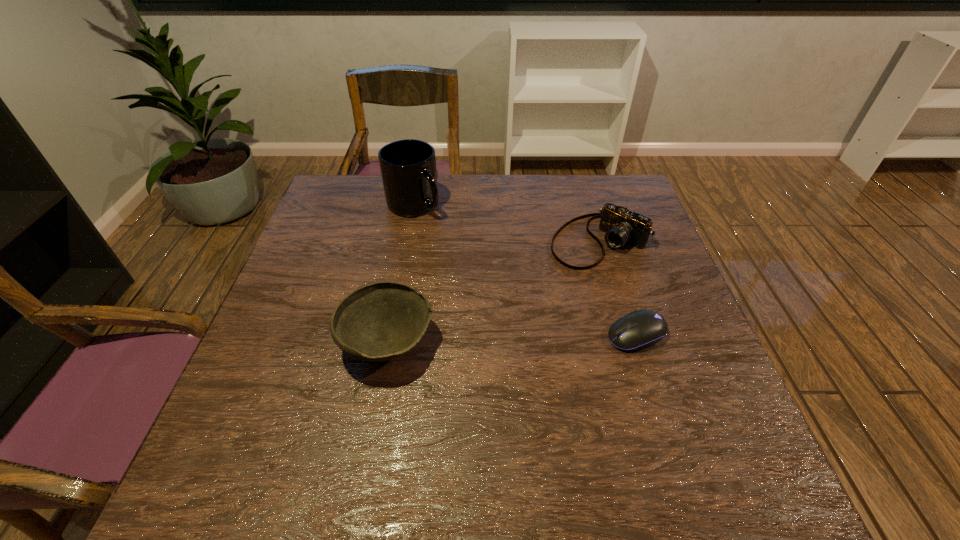
The width and height of the screenshot is (960, 540). What are the coordinates of `vacant space located on the front-facing side of the third tallest object` in the screenshot? It's located at (510, 312).

The height and width of the screenshot is (540, 960). I want to click on free space located on the front-facing side of the third tallest object, so (x=529, y=296).

The height and width of the screenshot is (540, 960). Find the location of `mug that is at the far edge`. mug that is at the far edge is located at coordinates (408, 167).

Identify the location of camera at the far edge. (621, 226).

This screenshot has height=540, width=960. What are the coordinates of `computer mouse that is at the right edge` in the screenshot? It's located at (640, 329).

The height and width of the screenshot is (540, 960). What are the coordinates of `camera at the right edge` in the screenshot? It's located at (621, 226).

The width and height of the screenshot is (960, 540). Identify the location of object present at the far right corner. (621, 226).

Identify the location of vacant point at the far edge. (472, 183).

In the image, there is a desktop. Where is `vacant region at the left edge`? vacant region at the left edge is located at coordinates (297, 340).

Where is `vacant area at the right edge of the desktop`? vacant area at the right edge of the desktop is located at coordinates (653, 357).